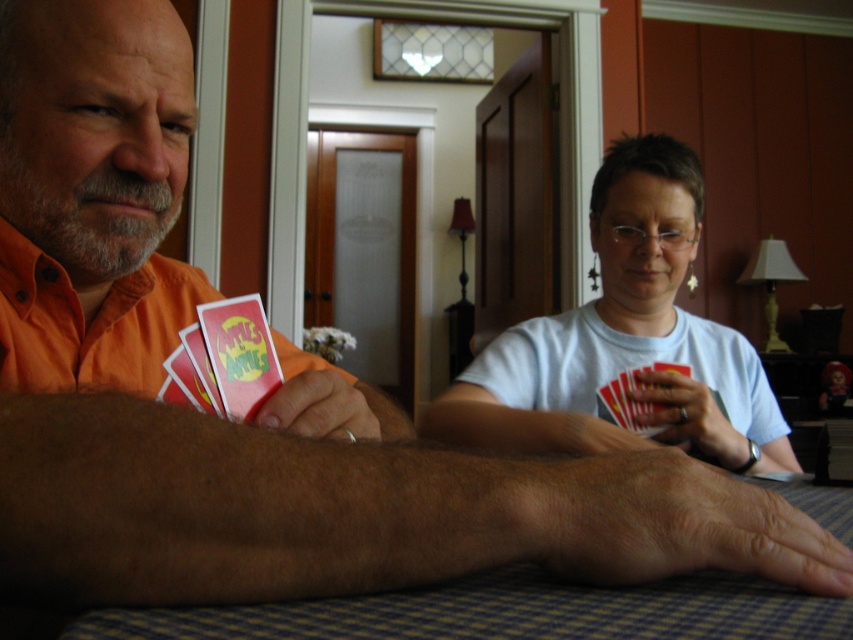
Question: Can you confirm if white matte t-shirt at center is smaller than blue checkered table at lower center?

Choices:
 (A) no
 (B) yes

Answer: (A)

Question: Can you confirm if white matte t-shirt at center is positioned above blue checkered table at lower center?

Choices:
 (A) yes
 (B) no

Answer: (A)

Question: Among these objects, which one is farthest from the camera?

Choices:
 (A) white matte t-shirt at center
 (B) blue checkered table at lower center

Answer: (A)

Question: Can you confirm if white matte t-shirt at center is bigger than blue checkered table at lower center?

Choices:
 (A) no
 (B) yes

Answer: (B)